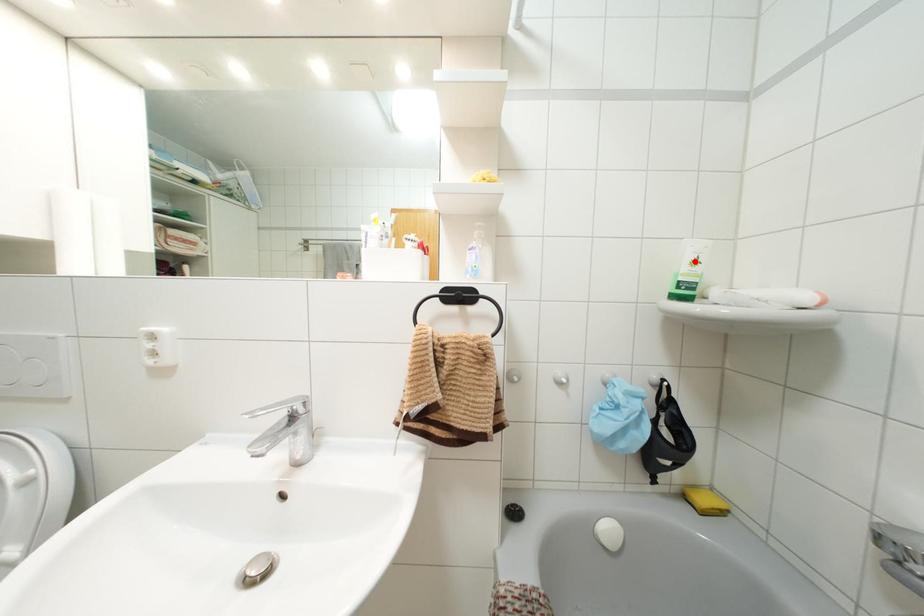
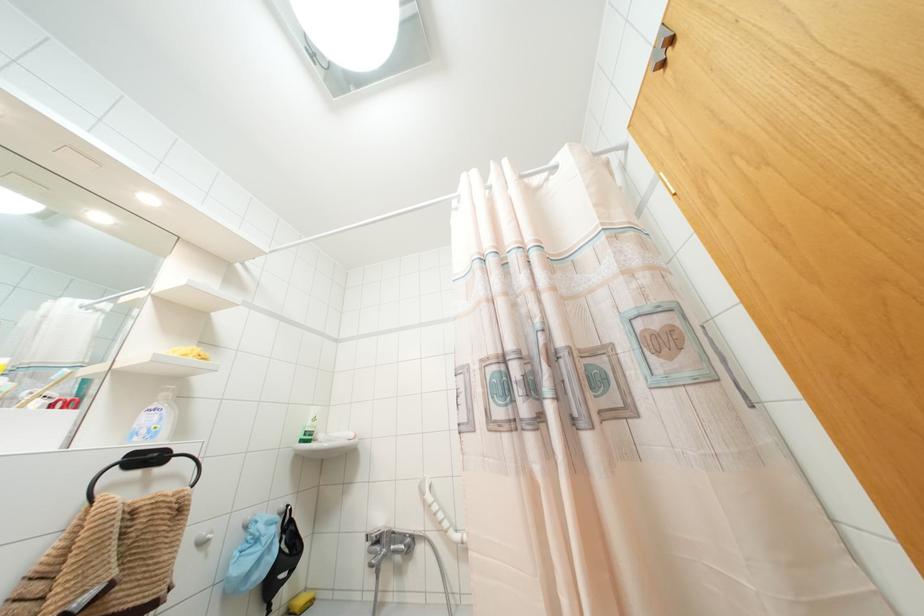
The point at the highlighted location is marked in the first image. Where is the corresponding point in the second image?

(312, 419)